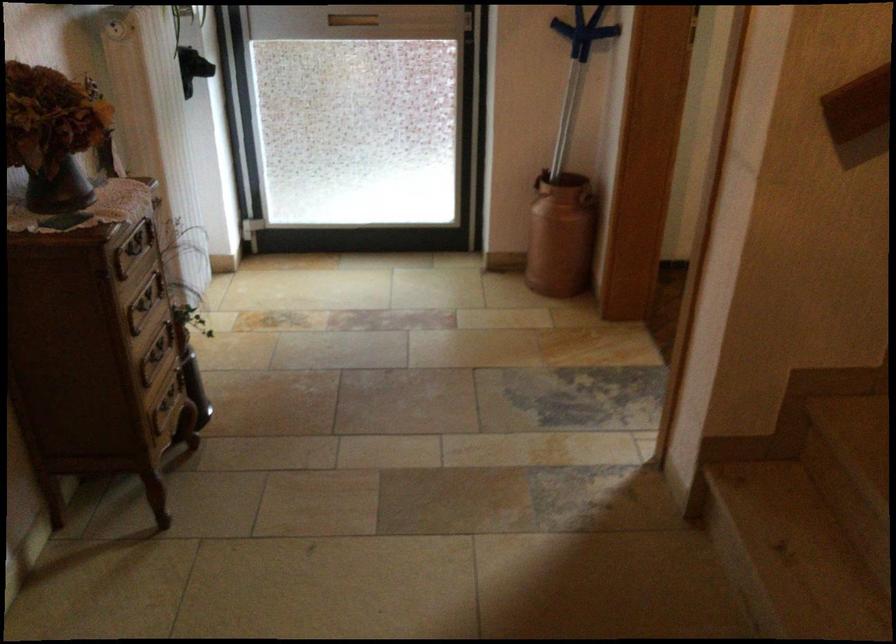
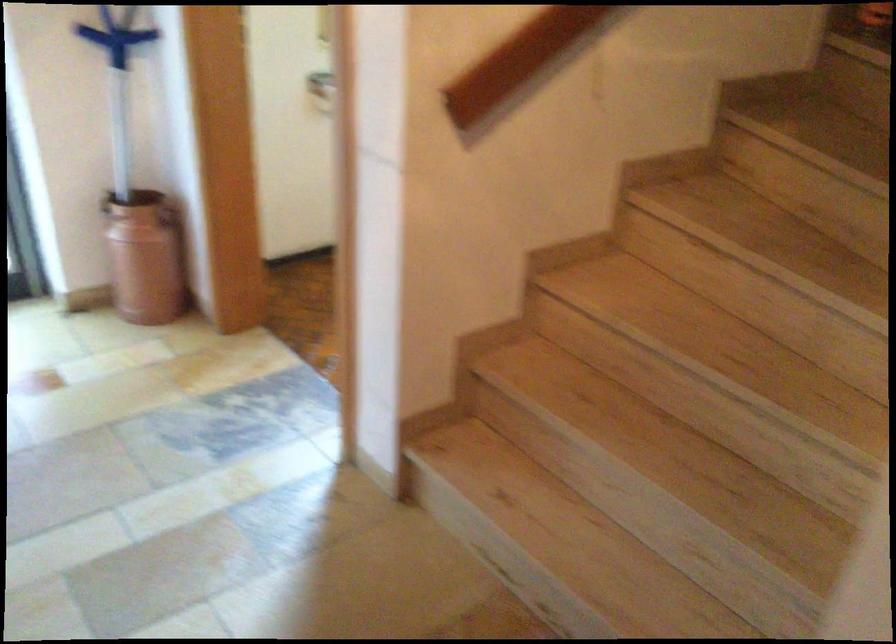
Locate, in the second image, the point that corresponds to (x=533, y=178) in the first image.

(105, 202)